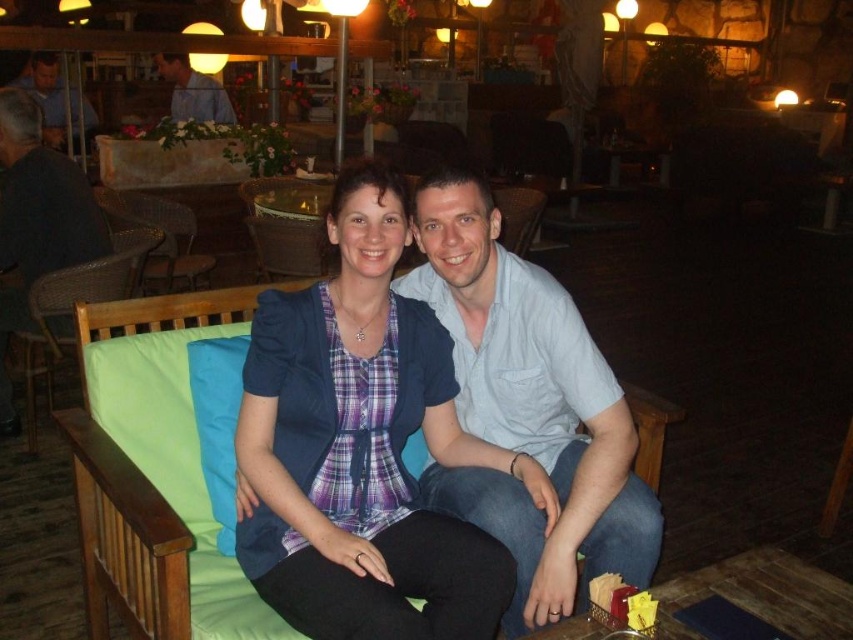
Question: Among these objects, which one is nearest to the camera?

Choices:
 (A) plaid fabric shirt at center
 (B) matte blue shirt at upper left
 (C) light blue cotton shirt at center

Answer: (A)

Question: Where is plaid fabric shirt at center located in relation to blue shirt at upper left in the image?

Choices:
 (A) left
 (B) right

Answer: (B)

Question: Is light blue cotton shirt at center closer to camera compared to blue fabric pillow at center?

Choices:
 (A) yes
 (B) no

Answer: (A)

Question: Does light blue cotton shirt at center come in front of dark gray fabric chair at left?

Choices:
 (A) no
 (B) yes

Answer: (B)

Question: Which point is closer to the camera?

Choices:
 (A) plaid fabric shirt at center
 (B) matte blue shirt at upper left
 (C) dark gray fabric chair at left
 (D) blue fabric pillow at center

Answer: (A)

Question: Which of the following is the farthest from the observer?

Choices:
 (A) plaid fabric shirt at center
 (B) dark gray fabric chair at left

Answer: (B)